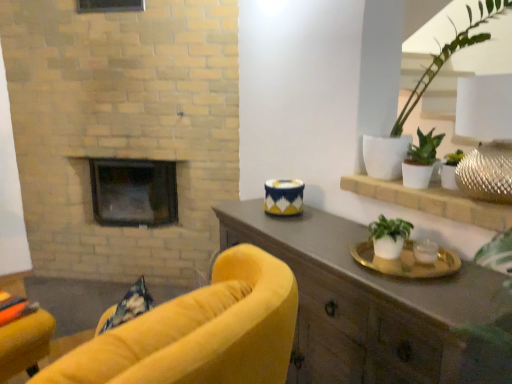
Question: From the image's perspective, is matte brown cabinet at right on top of white ceramic plant at upper right?

Choices:
 (A) yes
 (B) no

Answer: (B)

Question: Would you say matte brown cabinet at right contains white ceramic plant at upper right?

Choices:
 (A) no
 (B) yes

Answer: (A)

Question: Considering the relative sizes of matte brown cabinet at right and white ceramic plant at upper right in the image provided, is matte brown cabinet at right taller than white ceramic plant at upper right?

Choices:
 (A) no
 (B) yes

Answer: (B)

Question: Can you confirm if matte brown cabinet at right is positioned to the left of white ceramic plant at upper right?

Choices:
 (A) yes
 (B) no

Answer: (A)

Question: From a real-world perspective, is matte brown cabinet at right on white ceramic plant at upper right?

Choices:
 (A) yes
 (B) no

Answer: (B)

Question: Is matte brown cabinet at right facing away from white ceramic plant at upper right?

Choices:
 (A) no
 (B) yes

Answer: (A)

Question: Is white matte pot at upper right, the 1th houseplant from the top, at the left side of black glass fireplace at center?

Choices:
 (A) yes
 (B) no

Answer: (B)

Question: From a real-world perspective, is white matte pot at upper right, the 1th houseplant from the top, physically below black glass fireplace at center?

Choices:
 (A) yes
 (B) no

Answer: (B)

Question: Is white matte pot at upper right, the 1th houseplant from the top, smaller than black glass fireplace at center?

Choices:
 (A) no
 (B) yes

Answer: (B)

Question: Can you confirm if white matte pot at upper right, which appears as the 4th houseplant when ordered from the bottom, is bigger than black glass fireplace at center?

Choices:
 (A) no
 (B) yes

Answer: (A)

Question: Does white matte pot at upper right, the 1th houseplant from the top, lie in front of black glass fireplace at center?

Choices:
 (A) no
 (B) yes

Answer: (B)

Question: From the image's perspective, is white matte pot at upper right, which appears as the 4th houseplant when ordered from the bottom, under black glass fireplace at center?

Choices:
 (A) yes
 (B) no

Answer: (B)

Question: Would you consider white matte pot at upper right, the 1th houseplant from the top, to be distant from white matte plant at right, the first houseplant positioned from the bottom?

Choices:
 (A) no
 (B) yes

Answer: (A)